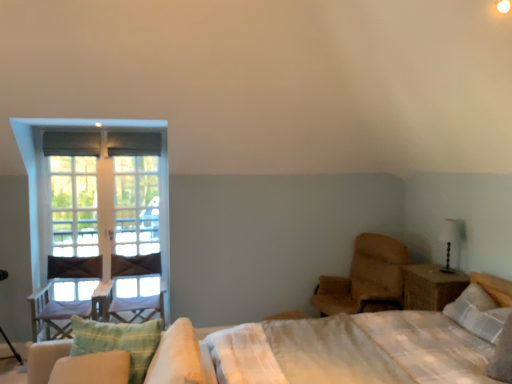
Question: Relative to green striped pillow at lower left, the 2th pillow viewed from the right, is light beige fabric mattress at right in front or behind?

Choices:
 (A) behind
 (B) front

Answer: (B)

Question: Is light beige fabric mattress at right inside or outside of green striped pillow at lower left, marked as the first pillow in a left-to-right arrangement?

Choices:
 (A) inside
 (B) outside

Answer: (B)

Question: Which of these objects is positioned closest to the wooden nightstand at right?

Choices:
 (A) white textured pillow at upper right, the first pillow in the back-to-front sequence
 (B) white glass screen door at left
 (C) green striped pillow at lower left, the 2th pillow viewed from the back
 (D) brown leather chair at right, which is the second chair in left-to-right order
 (E) white wooden window at left, positioned as the 1th window in right-to-left order

Answer: (A)

Question: Considering the real-world distances, which object is closest to the wooden chair at left, positioned as the second chair in right-to-left order?

Choices:
 (A) green striped pillow at lower left, the 2th pillow viewed from the right
 (B) wooden swivel chair at left
 (C) white glass screen door at left
 (D) clear glass window at left, marked as the first window in a left-to-right arrangement
 (E) matte black table lamp at right

Answer: (D)